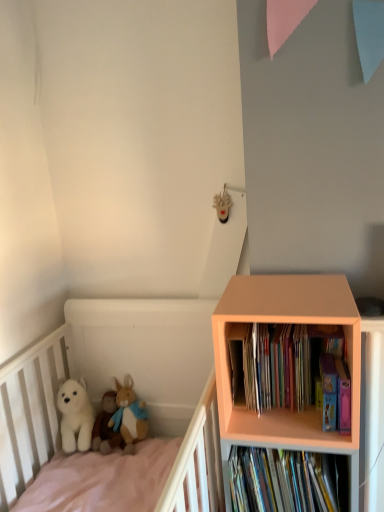
Question: Based on their sizes in the image, would you say multicolored cardboard books at right, positioned as the first book in top-to-bottom order, is bigger or smaller than white plush at left?

Choices:
 (A) big
 (B) small

Answer: (B)

Question: In terms of height, does multicolored cardboard books at right, the second book positioned from the bottom, look taller or shorter compared to white plush at left?

Choices:
 (A) short
 (B) tall

Answer: (A)

Question: Which object is the farthest from the white plush dog at lower left?

Choices:
 (A) hardcover books at lower right, marked as the 2th book in a top-to-bottom arrangement
 (B) peach wood bookcase at right
 (C) white plush at left
 (D) white plush bear at lower left, which is the first toy from left to right
 (E) multicolored cardboard books at right, the second book positioned from the bottom

Answer: (B)

Question: Based on their relative distances, which object is nearer to the white plush at left?

Choices:
 (A) hardcover books at lower right, which is the 1th book in bottom-to-top order
 (B) white plush dog at lower left
 (C) multicolored cardboard books at right, positioned as the first book in top-to-bottom order
 (D) fluffy brown plush at lower left, which appears as the 1th toy when viewed from the right
 (E) peach wood bookcase at right

Answer: (B)